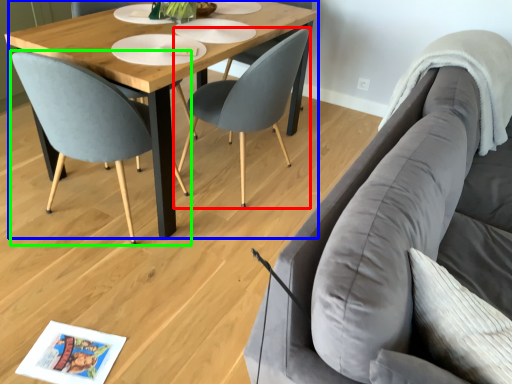
Question: Considering the real-world distances, which object is closest to chair (highlighted by a red box)? coffee table (highlighted by a blue box) or chair (highlighted by a green box).

Choices:
 (A) coffee table
 (B) chair

Answer: (A)